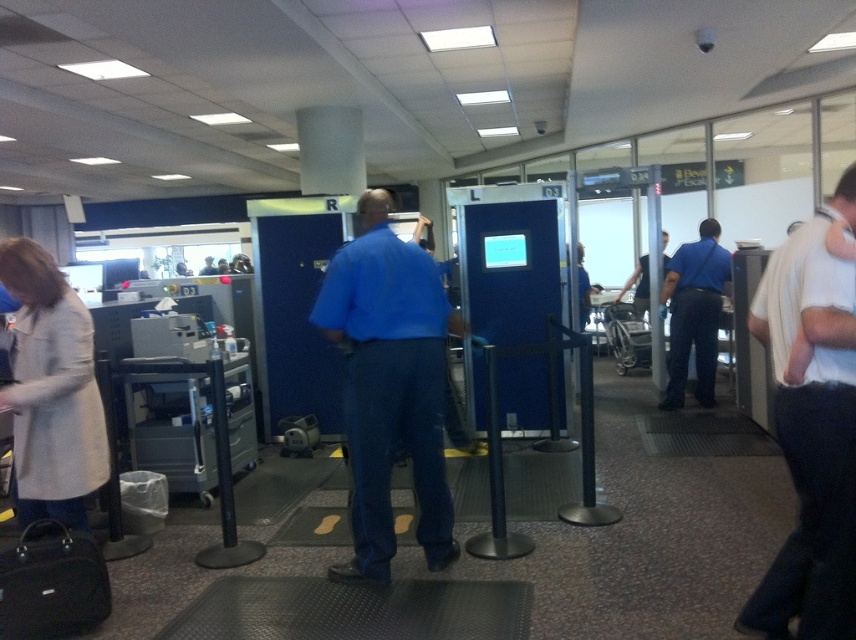
Is the position of white cotton shirt at right less distant than that of blue cotton shirt at center?

Yes, it is.

Is white cotton shirt at right further to the viewer compared to blue cotton shirt at center?

No, white cotton shirt at right is closer to the viewer.

Is point (780, 289) more distant than point (408, 445)?

No, (780, 289) is in front of (408, 445).

Find the location of a particular element. The image size is (856, 640). white cotton shirt at right is located at coordinates (811, 428).

Can you confirm if blue cotton shirt at center is shorter than blue uniform at center?

No.

Can you confirm if blue cotton shirt at center is positioned above blue uniform at center?

Incorrect, blue cotton shirt at center is not positioned above blue uniform at center.

Which is in front, point (382, 298) or point (684, 288)?

Point (382, 298) is in front.

This screenshot has height=640, width=856. I want to click on blue cotton shirt at center, so click(389, 385).

Between white cotton shirt at right and blue uniform at center, which one appears on the left side from the viewer's perspective?

Positioned to the left is white cotton shirt at right.

What do you see at coordinates (811, 428) in the screenshot? Image resolution: width=856 pixels, height=640 pixels. I see `white cotton shirt at right` at bounding box center [811, 428].

Find the location of `white cotton shirt at right`. white cotton shirt at right is located at coordinates 811,428.